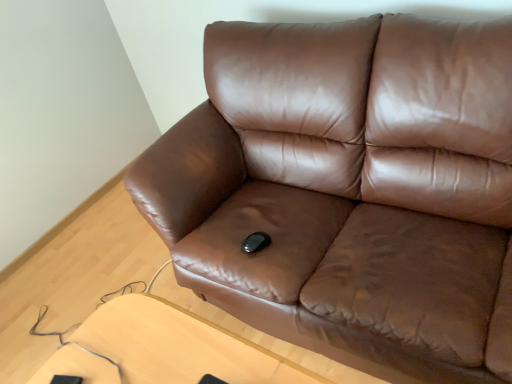
Question: Does brown leather couch at center have a larger size compared to light brown wooden table at lower center?

Choices:
 (A) yes
 (B) no

Answer: (A)

Question: Is brown leather couch at center oriented away from light brown wooden table at lower center?

Choices:
 (A) no
 (B) yes

Answer: (A)

Question: Is brown leather couch at center located outside light brown wooden table at lower center?

Choices:
 (A) no
 (B) yes

Answer: (B)

Question: Could you tell me if brown leather couch at center is turned towards light brown wooden table at lower center?

Choices:
 (A) yes
 (B) no

Answer: (A)

Question: From a real-world perspective, does brown leather couch at center stand above light brown wooden table at lower center?

Choices:
 (A) no
 (B) yes

Answer: (B)

Question: From the image's perspective, does brown leather couch at center appear higher than light brown wooden table at lower center?

Choices:
 (A) yes
 (B) no

Answer: (A)

Question: Is light brown wooden table at lower center turned away from brown leather couch at center?

Choices:
 (A) yes
 (B) no

Answer: (A)

Question: Considering the relative positions of light brown wooden table at lower center and brown leather couch at center in the image provided, is light brown wooden table at lower center in front of brown leather couch at center?

Choices:
 (A) no
 (B) yes

Answer: (A)

Question: Does light brown wooden table at lower center have a greater width compared to brown leather couch at center?

Choices:
 (A) no
 (B) yes

Answer: (A)

Question: Is light brown wooden table at lower center further to the viewer compared to brown leather couch at center?

Choices:
 (A) yes
 (B) no

Answer: (A)

Question: From the image's perspective, would you say light brown wooden table at lower center is shown under brown leather couch at center?

Choices:
 (A) no
 (B) yes

Answer: (B)

Question: Considering the relative sizes of light brown wooden table at lower center and brown leather couch at center in the image provided, is light brown wooden table at lower center shorter than brown leather couch at center?

Choices:
 (A) yes
 (B) no

Answer: (A)

Question: Would you say light brown wooden table at lower center is inside or outside brown leather couch at center?

Choices:
 (A) outside
 (B) inside

Answer: (A)